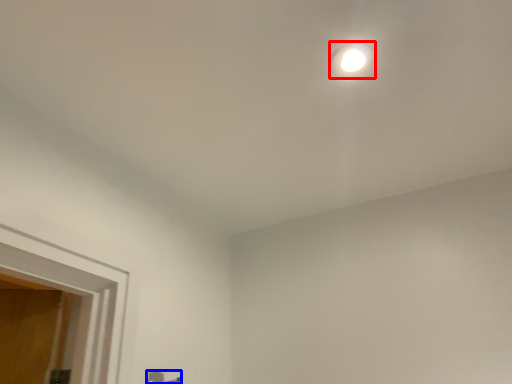
Question: Which point is further to the camera, droplight (highlighted by a red box) or door handle (highlighted by a blue box)?

Choices:
 (A) droplight
 (B) door handle

Answer: (B)